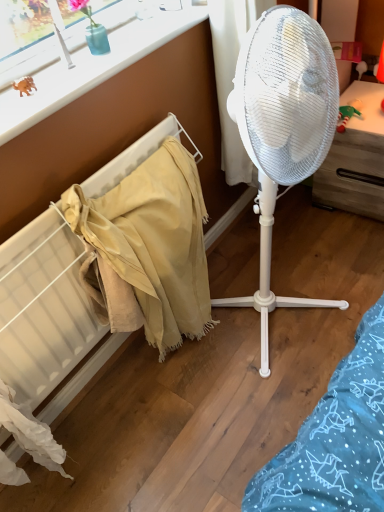
You are a GUI agent. You are given a task and a screenshot of the screen. Output one action in this format:
    pyautogui.click(x=<x>, y=<y>)
    Task: Click on the free space above white plastic window frame at upper left (from a real-world perspective)
    The height and width of the screenshot is (512, 384).
    Given the screenshot: What is the action you would take?
    pyautogui.click(x=84, y=61)